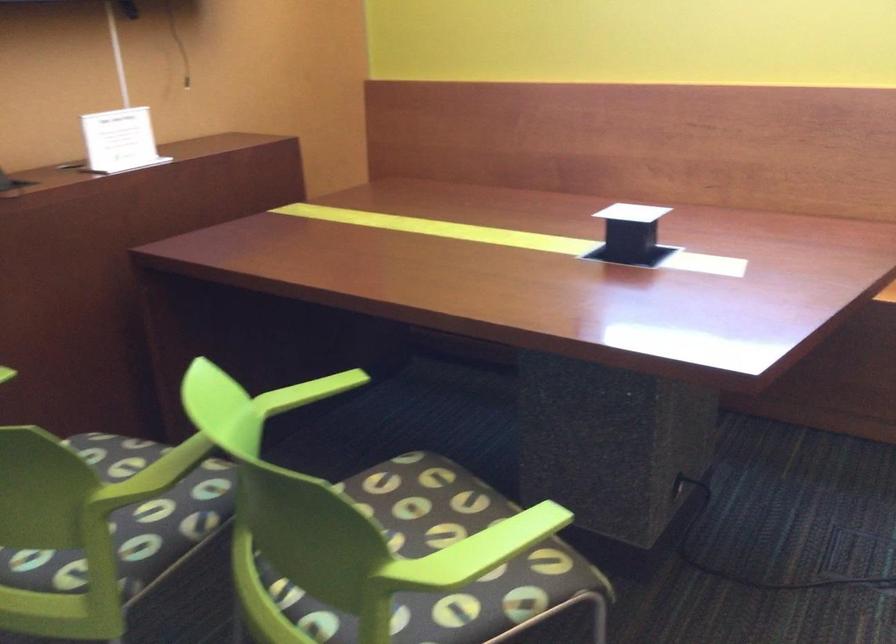
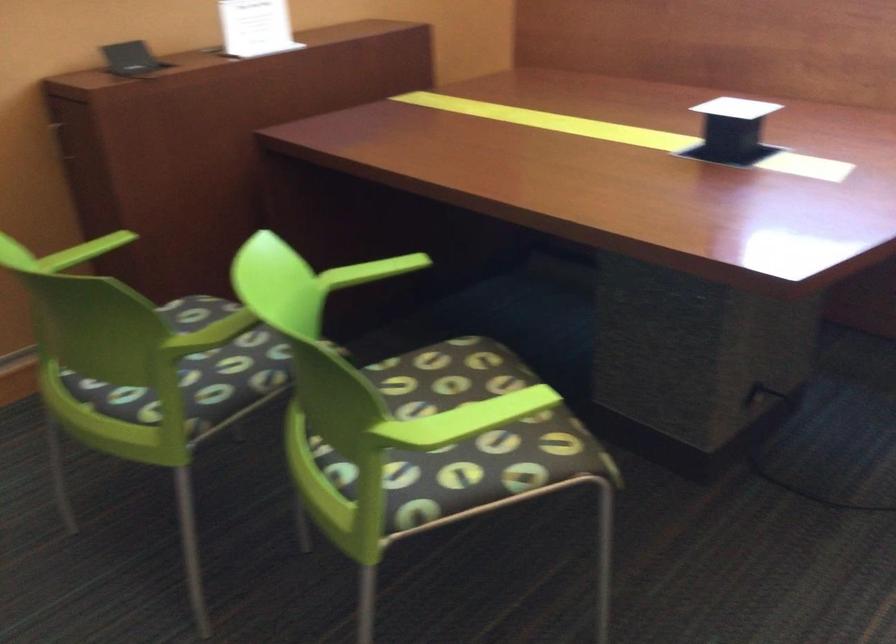
Question: The camera is either moving clockwise (left) or counter-clockwise (right) around the object. The first image is from the beginning of the video and the second image is from the end. Is the camera moving left or right when shooting the video?

Choices:
 (A) Left
 (B) Right

Answer: (B)